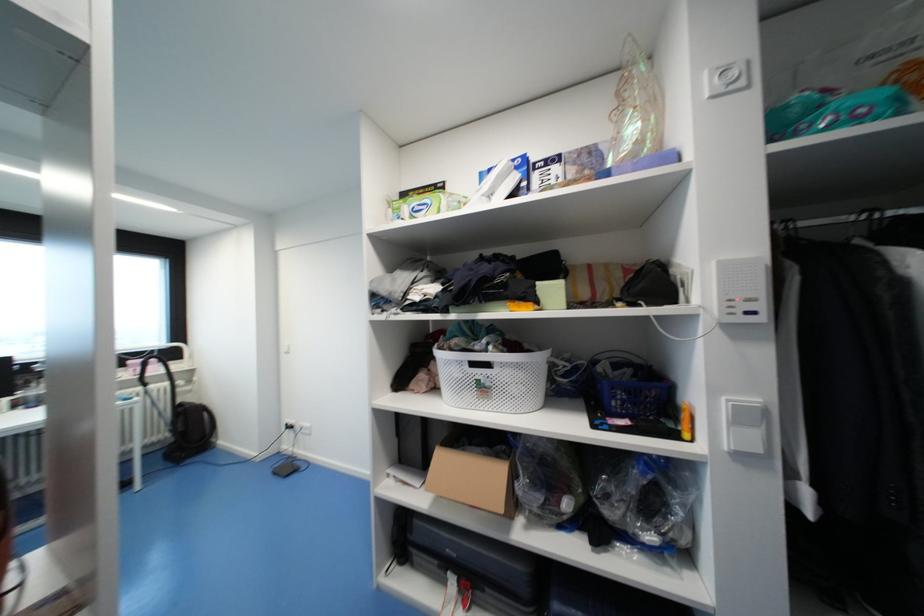
This screenshot has height=616, width=924. Find the location of `blue plastic basket`. blue plastic basket is located at coordinates (630, 389).